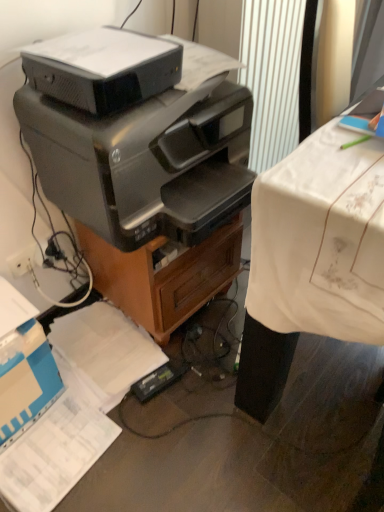
Question: From a real-world perspective, is metallic brown file cabinet at center located beneath white plastic plug at lower left?

Choices:
 (A) no
 (B) yes

Answer: (B)

Question: Considering the relative sizes of metallic brown file cabinet at center and white plastic plug at lower left in the image provided, is metallic brown file cabinet at center shorter than white plastic plug at lower left?

Choices:
 (A) yes
 (B) no

Answer: (B)

Question: Is metallic brown file cabinet at center smaller than white plastic plug at lower left?

Choices:
 (A) no
 (B) yes

Answer: (A)

Question: Considering the relative sizes of metallic brown file cabinet at center and white plastic plug at lower left in the image provided, is metallic brown file cabinet at center thinner than white plastic plug at lower left?

Choices:
 (A) no
 (B) yes

Answer: (A)

Question: Considering the relative positions of metallic brown file cabinet at center and white plastic plug at lower left in the image provided, is metallic brown file cabinet at center to the left of white plastic plug at lower left from the viewer's perspective?

Choices:
 (A) yes
 (B) no

Answer: (B)

Question: From the image's perspective, is metallic brown file cabinet at center on top of white plastic plug at lower left?

Choices:
 (A) no
 (B) yes

Answer: (B)

Question: Is black glossy printer at center, the 2th printer viewed from the top, at the back of white plastic plug at lower left?

Choices:
 (A) yes
 (B) no

Answer: (B)

Question: Is white plastic plug at lower left wider than black glossy printer at center, the 2th printer viewed from the top?

Choices:
 (A) no
 (B) yes

Answer: (A)

Question: Considering the relative sizes of white plastic plug at lower left and black glossy printer at center, the 2th printer viewed from the top, in the image provided, is white plastic plug at lower left shorter than black glossy printer at center, the 2th printer viewed from the top,?

Choices:
 (A) yes
 (B) no

Answer: (A)

Question: Is white plastic plug at lower left facing towards black glossy printer at center, placed as the first printer when sorted from bottom to top?

Choices:
 (A) no
 (B) yes

Answer: (A)

Question: Is white plastic plug at lower left outside of black glossy printer at center, placed as the first printer when sorted from bottom to top?

Choices:
 (A) yes
 (B) no

Answer: (A)

Question: Considering the relative positions of white plastic plug at lower left and black glossy printer at center, the 2th printer viewed from the top, in the image provided, is white plastic plug at lower left to the right of black glossy printer at center, the 2th printer viewed from the top, from the viewer's perspective?

Choices:
 (A) yes
 (B) no

Answer: (B)

Question: Could white cloth-covered desk at right be considered to be inside black glossy printer at center, placed as the first printer when sorted from bottom to top?

Choices:
 (A) no
 (B) yes

Answer: (A)